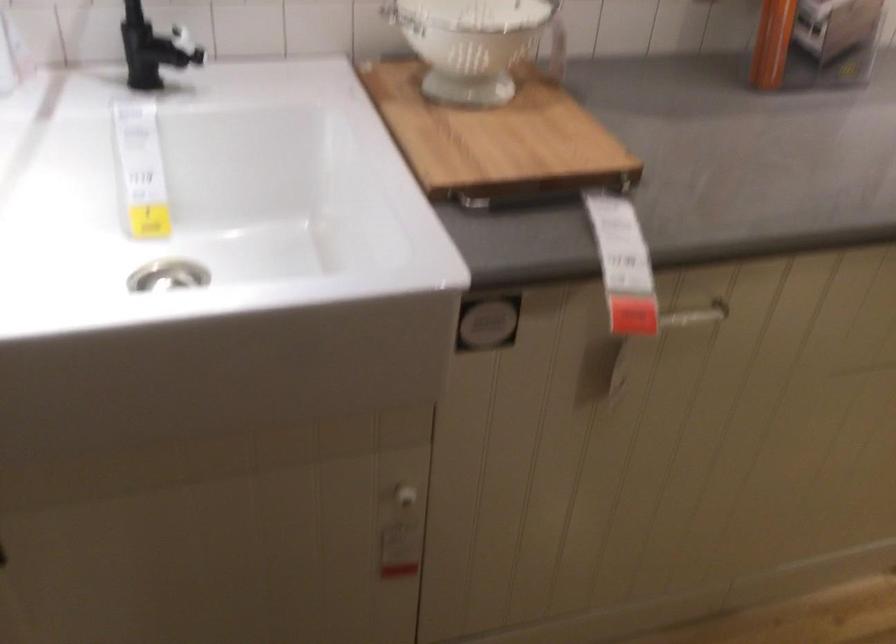
Find the location of a particular element. white colander is located at coordinates (471, 43).